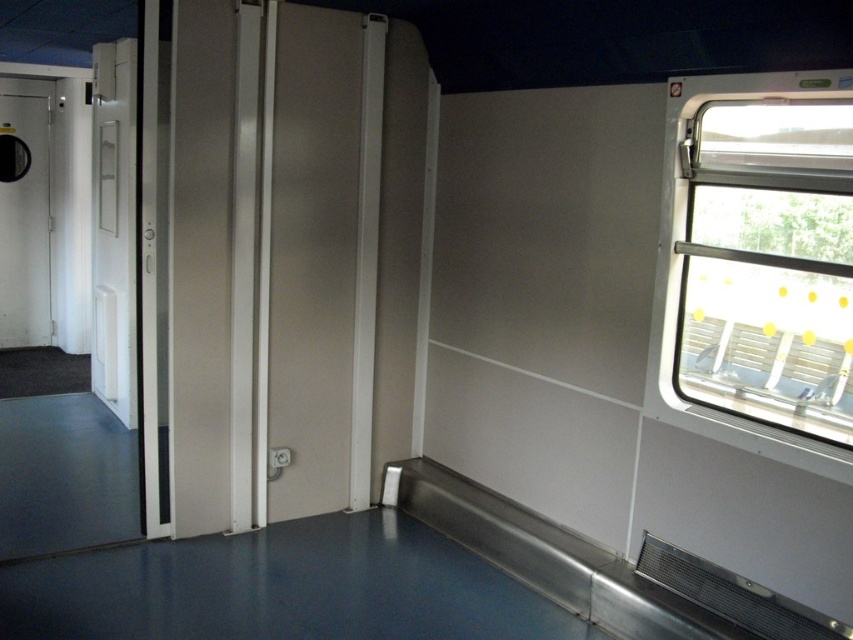
You are a passenger on a train and need to see the view outside. You see the transparent glass window at right and the white glossy door at left. Which object should you approach to look outside?

The transparent glass window at right is located below the white glossy door at left, so you should approach the transparent glass window at right to look outside.

You are standing in a train car and need to reach the white glossy door at left. If you are currently 4 meters away from it, can you reach the door without moving forward?

The white glossy door at left is 4.39 meters away from you, so you are currently 4 meters away, which means you are still 0.39 meters away from the door. You need to move forward slightly to reach it.